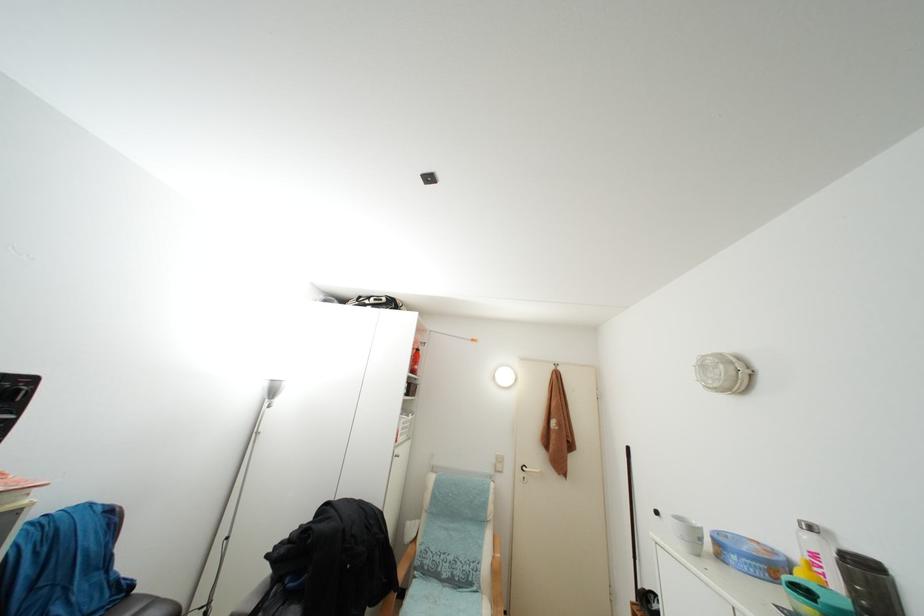
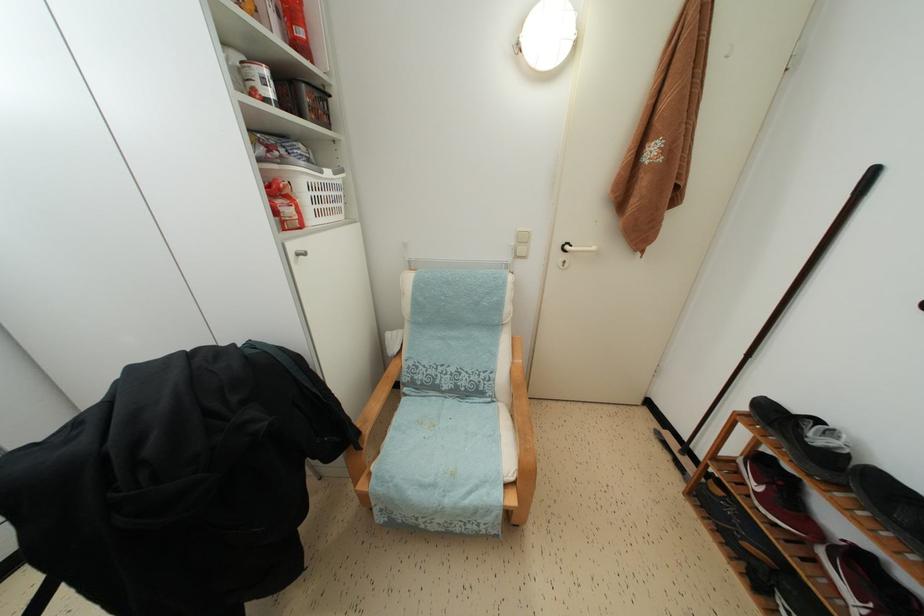
Locate, in the second image, the point that corresponds to point (407, 435) in the first image.

(319, 206)